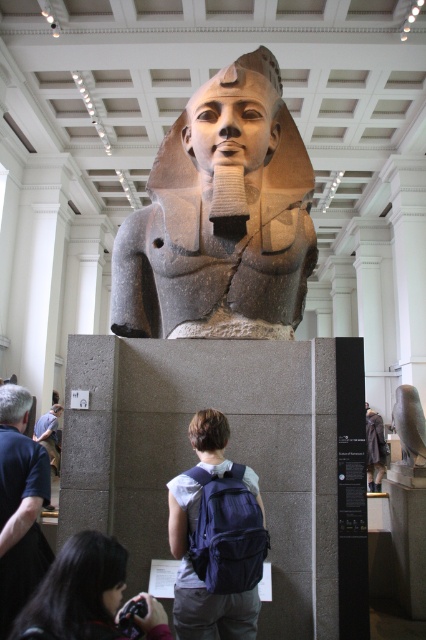
Is point (207, 563) positioned before point (377, 456)?

Yes, point (207, 563) is in front of point (377, 456).

Does blue fabric backpack at lower center have a lesser height compared to fuzzy gray coat at lower right?

Yes.

Which is behind, point (216, 524) or point (377, 436)?

Point (377, 436)

Image resolution: width=426 pixels, height=640 pixels. Find the location of `blue fabric backpack at lower center`. blue fabric backpack at lower center is located at coordinates (215, 538).

Does point (218, 148) come behind point (367, 477)?

That is False.

Can you confirm if polished stone head at center is thinner than fuzzy gray coat at lower right?

Indeed, polished stone head at center has a lesser width compared to fuzzy gray coat at lower right.

Between point (241, 150) and point (365, 406), which one is positioned in front?

Point (365, 406)

Where is `polished stone head at center`? This screenshot has width=426, height=640. polished stone head at center is located at coordinates (232, 122).

Measure the distance between polished stone head at center and camera.

12.02 meters

Describe the element at coordinates (232, 122) in the screenshot. I see `polished stone head at center` at that location.

The width and height of the screenshot is (426, 640). Describe the element at coordinates (232, 122) in the screenshot. I see `polished stone head at center` at that location.

In order to click on polished stone head at center in this screenshot , I will do `click(232, 122)`.